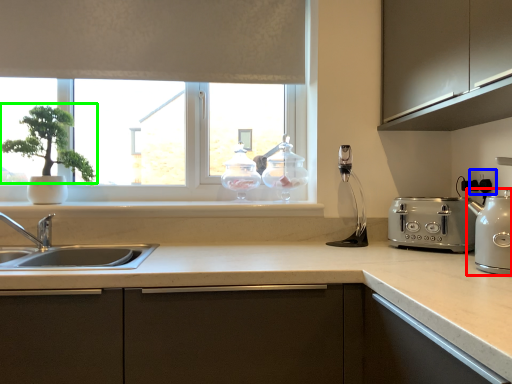
Question: Which is nearer to the kitchen appliance (highlighted by a red box)? electric outlet (highlighted by a blue box) or plant (highlighted by a green box).

Choices:
 (A) electric outlet
 (B) plant

Answer: (A)